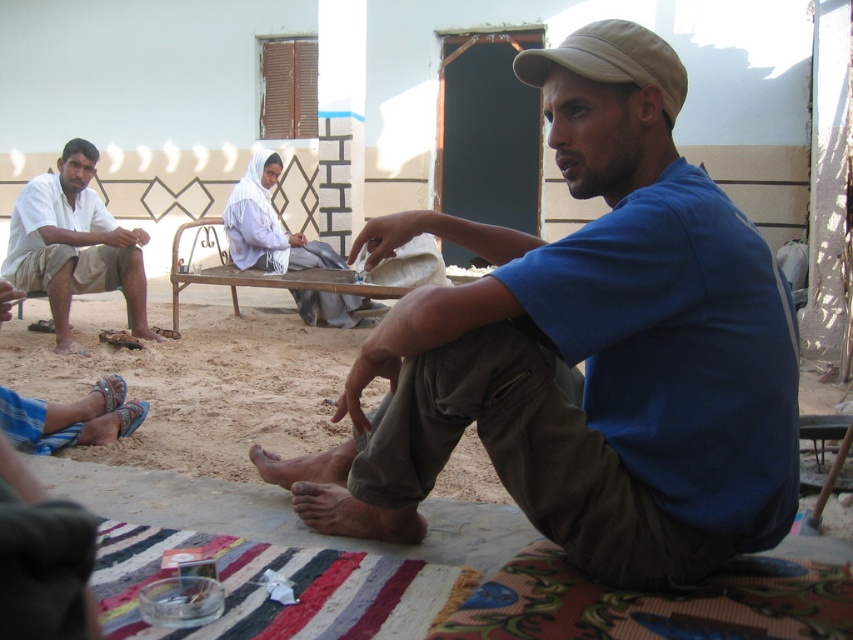
Can you confirm if blue cotton shirt at center is bigger than khaki fabric cap at upper right?

Yes, blue cotton shirt at center is bigger than khaki fabric cap at upper right.

Is blue cotton shirt at center to the left of khaki fabric cap at upper right from the viewer's perspective?

Correct, you'll find blue cotton shirt at center to the left of khaki fabric cap at upper right.

Locate an element on the screen. This screenshot has height=640, width=853. blue cotton shirt at center is located at coordinates (585, 349).

Identify the location of blue cotton shirt at center. Image resolution: width=853 pixels, height=640 pixels. (585, 349).

Locate an element on the screen. blue cotton shirt at center is located at coordinates (585, 349).

Does point (555, 420) come farther from viewer compared to point (61, 220)?

No, it is not.

Describe the element at coordinates (585, 349) in the screenshot. Image resolution: width=853 pixels, height=640 pixels. I see `blue cotton shirt at center` at that location.

At what (x,y) coordinates should I click in order to perform the action: click on blue cotton shirt at center. Please return your answer as a coordinate pair (x, y). The height and width of the screenshot is (640, 853). Looking at the image, I should click on (585, 349).

Is white cotton shirt at left bigger than khaki fabric cap at upper right?

Correct, white cotton shirt at left is larger in size than khaki fabric cap at upper right.

Can you confirm if white cotton shirt at left is thinner than khaki fabric cap at upper right?

No, white cotton shirt at left is not thinner than khaki fabric cap at upper right.

Between point (16, 282) and point (641, 80), which one is positioned behind?

Positioned behind is point (16, 282).

The height and width of the screenshot is (640, 853). Find the location of `white cotton shirt at left`. white cotton shirt at left is located at coordinates (74, 244).